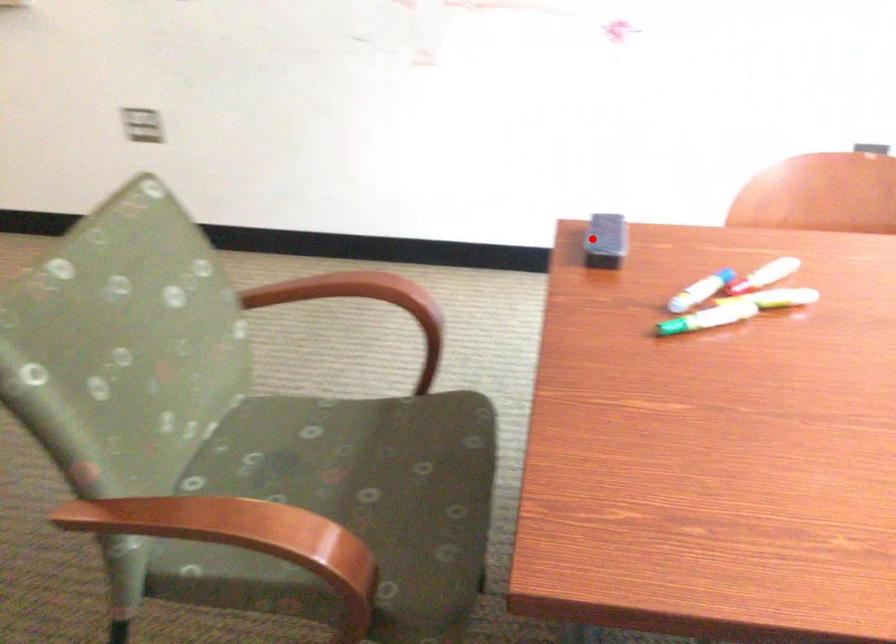
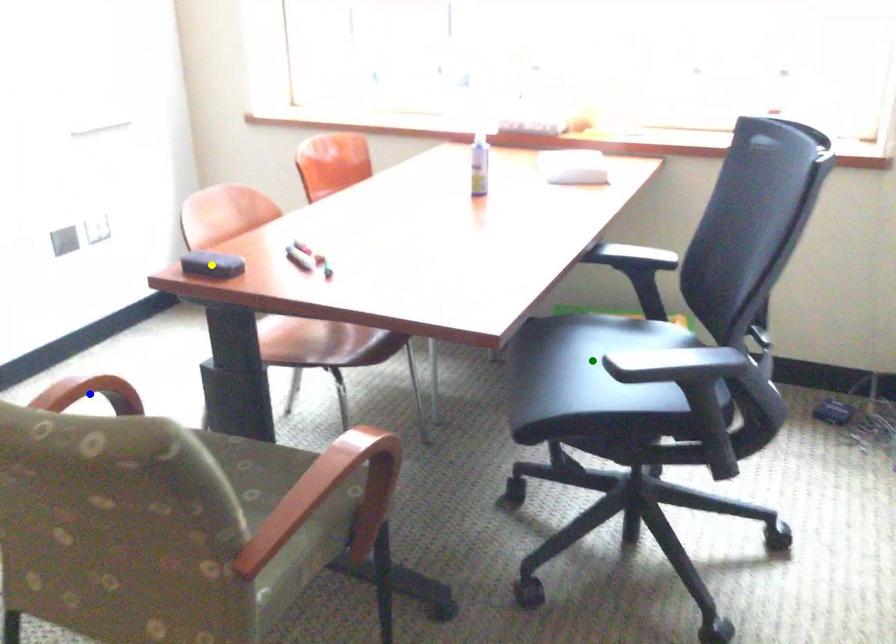
Question: I am providing you with two images of the same scene from different viewpoints. A red point is marked on the first image. You are given multiple points on the second image. Which spot in image 2 lines up with the point in image 1?

Choices:
 (A) green point
 (B) yellow point
 (C) blue point

Answer: (B)